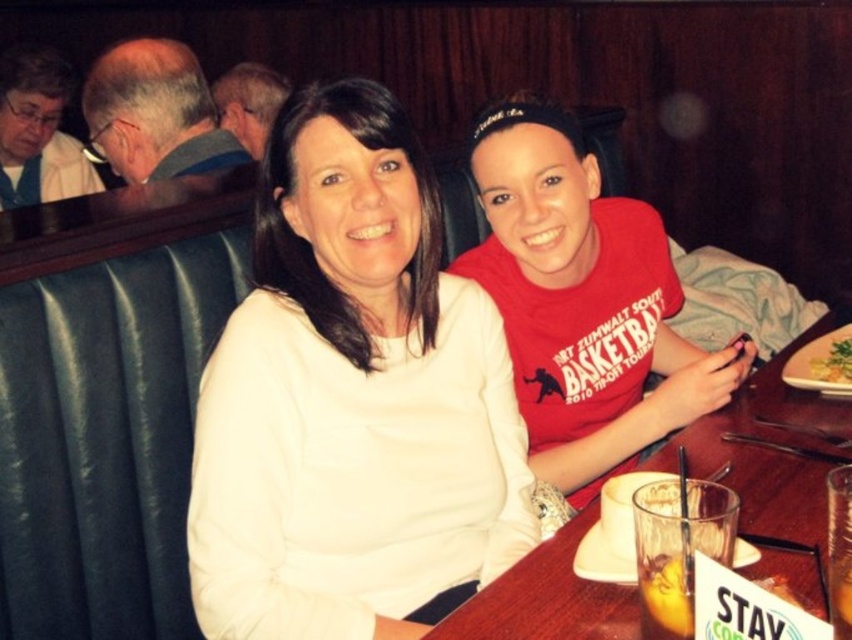
You are a photographer trying to capture a photo of the two people at the table. You want to ensure that the white matte sweater at center and the red matte shirt at center are both clearly visible in the frame. Based on their positions, which one should you focus on first to ensure both are in focus?

The white matte sweater at center is to the left of the red matte shirt at center, so focusing on the white matte sweater at center first will help ensure both are in focus as they are positioned side by side.

You are sitting at the table in the image and want to place your phone between the two points labeled point (430,221) and point (810,365). Which point should you place it closer to so that it stays in front of the other point?

You should place the phone closer to point (430,221) because it is in front of point (810,365).

You are a waiter who needs to deliver a dessert to the table. The dessert plate is 12 inches in diameter. Can you place it between the red matte shirt at center and the translucent glass at table right without touching either?

The distance between the red matte shirt at center and the translucent glass at table right is 26.64 inches. Since the dessert plate is only 12 inches wide, there is enough space to place it between them without touching either object.